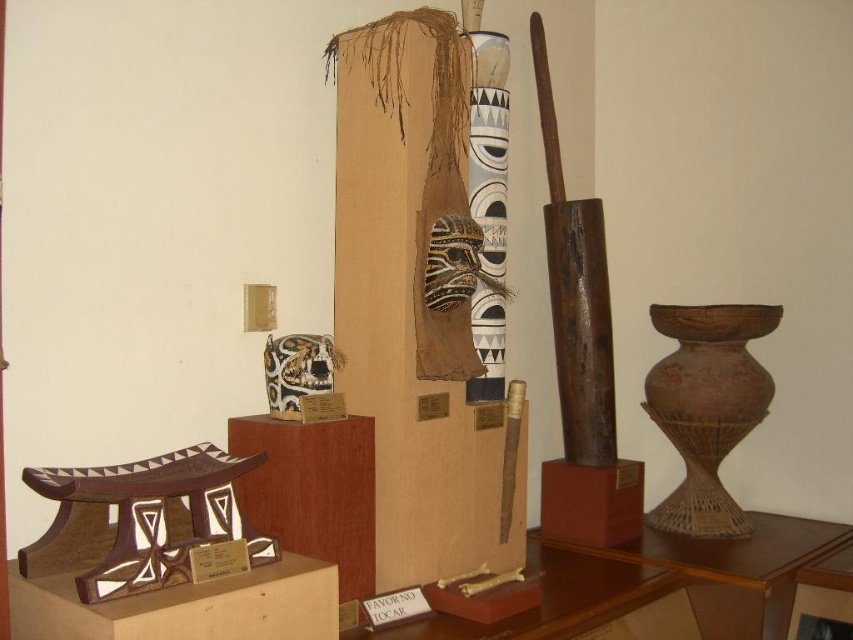
Can you confirm if wooden totem pole at center is shorter than matte brown vase at center?

No.

Based on the photo, who is shorter, wooden totem pole at center or matte brown vase at center?

Standing shorter between the two is matte brown vase at center.

Image resolution: width=853 pixels, height=640 pixels. Describe the element at coordinates (579, 356) in the screenshot. I see `wooden totem pole at center` at that location.

This screenshot has width=853, height=640. I want to click on wooden totem pole at center, so click(579, 356).

Is brown woven vase at right closer to the viewer compared to black woven mask at center?

No, it is not.

Image resolution: width=853 pixels, height=640 pixels. In order to click on brown woven vase at right in this screenshot , I will do `click(706, 406)`.

Between matte brown vase at center and black woven mask at center, which one is positioned higher?

matte brown vase at center is above.

Between matte brown vase at center and black woven mask at center, which one is positioned lower?

black woven mask at center is lower down.

The height and width of the screenshot is (640, 853). What are the coordinates of `matte brown vase at center` in the screenshot? It's located at (489, 145).